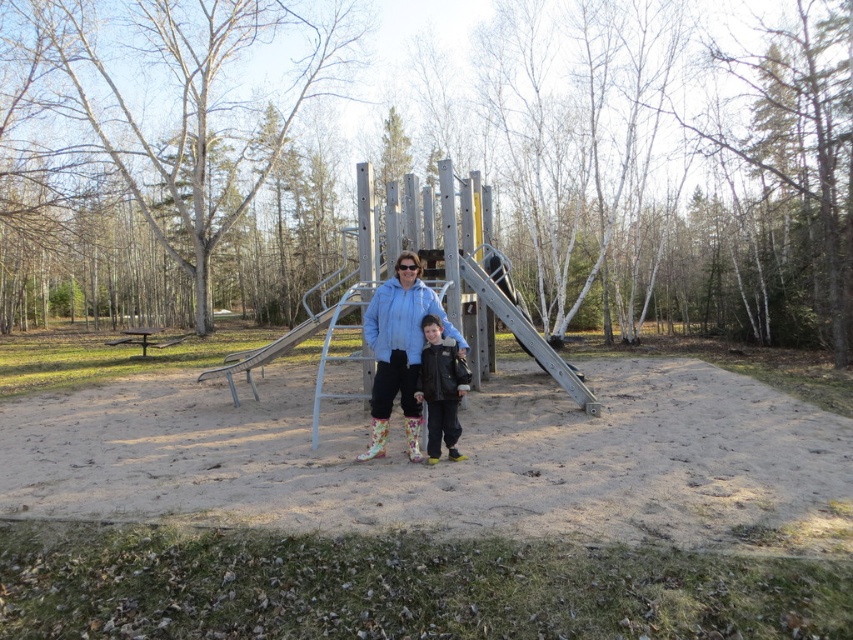
You are a parent at the playground. You see the matte blue jacket at center and the metallic silver slide at center. Which object is higher from the ground?

The matte blue jacket at center is above the metallic silver slide at center, so the matte blue jacket at center is higher from the ground.

You are a parent at the playground and want to place your black leather jacket at center on a bench. However, there are no benches in the scene. Where could you place the jacket so it stays visible but not in the way of the slide or climbing bars?

Since there are no benches available, you could place the black leather jacket at center on the sandy surface near the edge of the play area to keep it visible and out of the way of the slide and climbing bars.